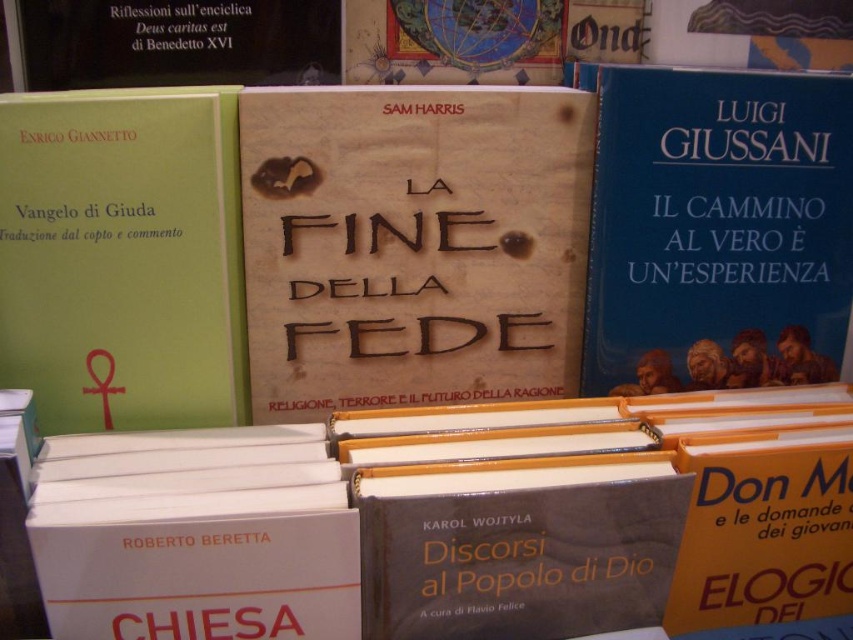
You are a customer standing in front of the bookshelf. You want to reach the beige paper book at center to read its title. Can you comfortably do so without moving your body? Please explain your reasoning.

The beige paper book at center is positioned 23.84 inches away from the viewer. Since this distance is within a typical comfortable reach range, you can likely reach it without moving your body.

You are organizing a shelf in a library. You have to place the blue matte book at right and the green matte book at left. According to the current arrangement, which book is placed on top of the other?

The blue matte book at right is positioned over the green matte book at left, so it is placed on top of it.

Where is the beige paper book at center located?

The beige paper book at center is located at point (412,244).